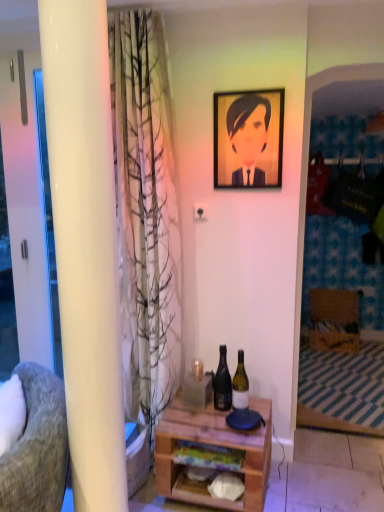
Question: Does wooden desk at center have a greater width compared to textured gray fabric chair at left?

Choices:
 (A) yes
 (B) no

Answer: (A)

Question: Is wooden desk at center oriented towards textured gray fabric chair at left?

Choices:
 (A) yes
 (B) no

Answer: (A)

Question: From the image's perspective, does wooden desk at center appear lower than textured gray fabric chair at left?

Choices:
 (A) yes
 (B) no

Answer: (A)

Question: Considering the relative sizes of wooden desk at center and textured gray fabric chair at left in the image provided, is wooden desk at center shorter than textured gray fabric chair at left?

Choices:
 (A) yes
 (B) no

Answer: (A)

Question: Would you say wooden desk at center contains textured gray fabric chair at left?

Choices:
 (A) no
 (B) yes

Answer: (A)

Question: From a real-world perspective, is wooden desk at center on top of textured gray fabric chair at left?

Choices:
 (A) no
 (B) yes

Answer: (A)

Question: Could you tell me if textured gray fabric chair at left is turned towards green glass bottle at center, the first bottle viewed from the right?

Choices:
 (A) no
 (B) yes

Answer: (A)

Question: Is textured gray fabric chair at left positioned in front of green glass bottle at center, the 2th bottle when ordered from left to right?

Choices:
 (A) yes
 (B) no

Answer: (A)

Question: Is textured gray fabric chair at left positioned behind green glass bottle at center, the first bottle viewed from the right?

Choices:
 (A) yes
 (B) no

Answer: (B)

Question: From a real-world perspective, is textured gray fabric chair at left on top of green glass bottle at center, the 2th bottle when ordered from left to right?

Choices:
 (A) no
 (B) yes

Answer: (A)

Question: Does textured gray fabric chair at left have a lesser width compared to green glass bottle at center, the first bottle viewed from the right?

Choices:
 (A) no
 (B) yes

Answer: (A)

Question: Is textured gray fabric chair at left at the right side of green glass bottle at center, the 2th bottle when ordered from left to right?

Choices:
 (A) no
 (B) yes

Answer: (A)

Question: Considering the relative sizes of green glass bottle at center, the first bottle viewed from the right, and wooden desk at center in the image provided, is green glass bottle at center, the first bottle viewed from the right, smaller than wooden desk at center?

Choices:
 (A) no
 (B) yes

Answer: (B)